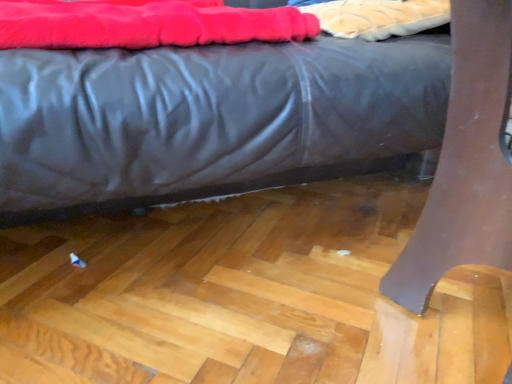
Question: Is matte black bed at center wider than velvet-like fabric at upper center?

Choices:
 (A) yes
 (B) no

Answer: (A)

Question: Is the depth of matte black bed at center less than that of velvet-like fabric at upper center?

Choices:
 (A) yes
 (B) no

Answer: (A)

Question: Does matte black bed at center touch velvet-like fabric at upper center?

Choices:
 (A) no
 (B) yes

Answer: (A)

Question: Is velvet-like fabric at upper center surrounded by matte black bed at center?

Choices:
 (A) no
 (B) yes

Answer: (B)

Question: From the image's perspective, would you say matte black bed at center is positioned over velvet-like fabric at upper center?

Choices:
 (A) yes
 (B) no

Answer: (B)

Question: In terms of size, does velvet-like fabric at upper center appear bigger or smaller than matte black bed at center?

Choices:
 (A) big
 (B) small

Answer: (B)

Question: From their relative heights in the image, would you say velvet-like fabric at upper center is taller or shorter than matte black bed at center?

Choices:
 (A) tall
 (B) short

Answer: (B)

Question: Does point (408, 3) appear closer or farther from the camera than point (117, 180)?

Choices:
 (A) closer
 (B) farther

Answer: (B)

Question: Do you think velvet-like fabric at upper center is within matte black bed at center, or outside of it?

Choices:
 (A) outside
 (B) inside

Answer: (B)

Question: Would you say velvet-like fabric at upper center is to the left or to the right of velvet-like red blanket at upper left in the picture?

Choices:
 (A) right
 (B) left

Answer: (A)

Question: In terms of size, does velvet-like fabric at upper center appear bigger or smaller than velvet-like red blanket at upper left?

Choices:
 (A) big
 (B) small

Answer: (B)

Question: Is velvet-like fabric at upper center taller or shorter than velvet-like red blanket at upper left?

Choices:
 (A) short
 (B) tall

Answer: (A)

Question: From a real-world perspective, is velvet-like fabric at upper center above or below velvet-like red blanket at upper left?

Choices:
 (A) below
 (B) above

Answer: (B)

Question: Visually, is matte black bed at center positioned to the left or to the right of velvet-like fabric at upper center?

Choices:
 (A) right
 (B) left

Answer: (B)

Question: In terms of height, does matte black bed at center look taller or shorter compared to velvet-like fabric at upper center?

Choices:
 (A) short
 (B) tall

Answer: (B)